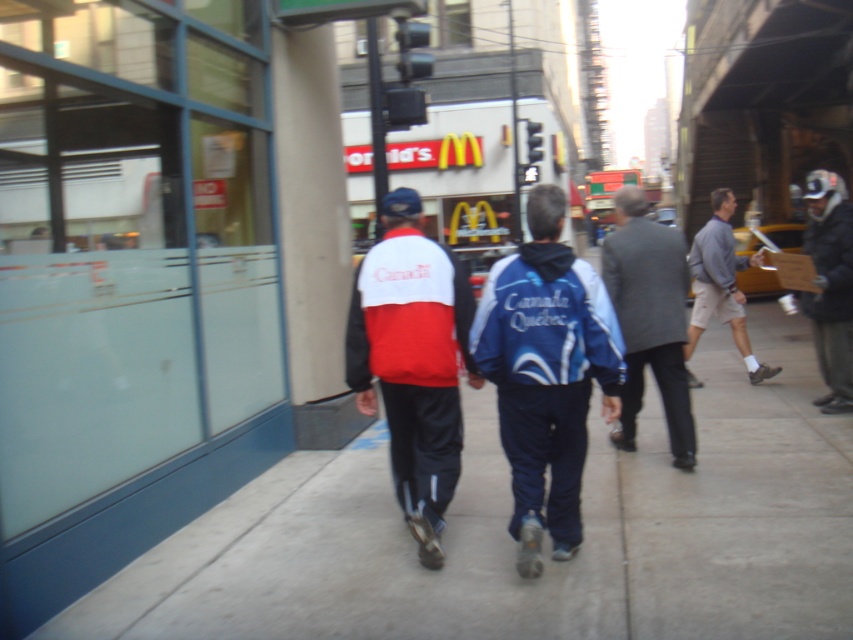
Question: Considering the real-world distances, which object is closest to the gray fabric jacket at right?

Choices:
 (A) smooth concrete sidewalk at center
 (B) dark gray jacket at right

Answer: (B)

Question: Does matte red and white jacket at center have a smaller size compared to gray fabric jacket at right?

Choices:
 (A) yes
 (B) no

Answer: (A)

Question: Which point is closer to the camera?

Choices:
 (A) (614, 604)
 (B) (367, 298)

Answer: (A)

Question: Which of these objects is positioned farthest from the smooth concrete sidewalk at center?

Choices:
 (A) gray wool suit at center
 (B) gray fabric jacket at right

Answer: (B)

Question: Does smooth concrete sidewalk at center come behind gray fabric jacket at right?

Choices:
 (A) no
 (B) yes

Answer: (A)

Question: Is blue fabric jacket at center to the left of dark gray jacket at right from the viewer's perspective?

Choices:
 (A) yes
 (B) no

Answer: (A)